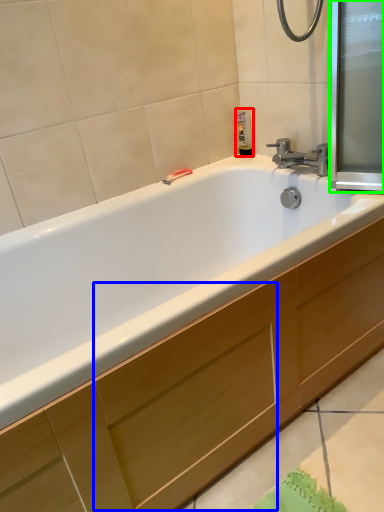
Question: Considering the real-world distances, which object is farthest from soap dispenser (highlighted by a red box)? drawer (highlighted by a blue box) or screen door (highlighted by a green box)?

Choices:
 (A) drawer
 (B) screen door

Answer: (A)